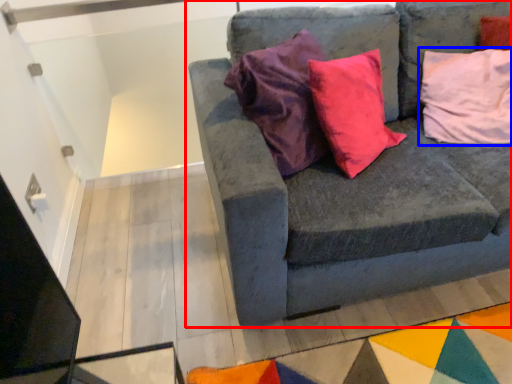
Question: Which object is further to the camera taking this photo, studio couch (highlighted by a red box) or pillow (highlighted by a blue box)?

Choices:
 (A) studio couch
 (B) pillow

Answer: (B)